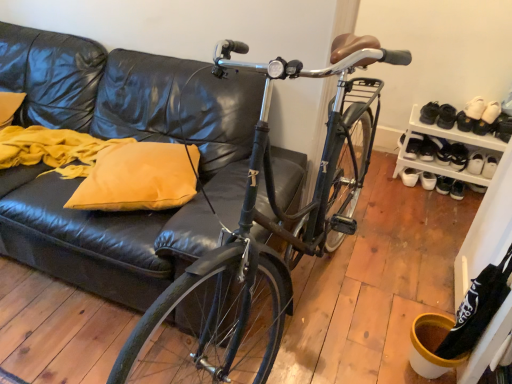
The image size is (512, 384). What do you see at coordinates (459, 156) in the screenshot? I see `black suede shoe at lower right, arranged as the fifth footwear when viewed from the right` at bounding box center [459, 156].

This screenshot has width=512, height=384. What do you see at coordinates (139, 178) in the screenshot?
I see `yellow fabric pillow at left` at bounding box center [139, 178].

Describe the element at coordinates (503, 128) in the screenshot. I see `white leather shoe at upper right, arranged as the 1th shoe when viewed from the front` at that location.

The image size is (512, 384). Identify the location of white leather shoe at upper right, the second shoe positioned from the left. (503, 128).

Find the location of a particular element. This screenshot has height=384, width=512. black suede shoe at lower right, arranged as the fifth footwear when viewed from the right is located at coordinates (459, 156).

What's the angular difference between white leather shoe at lower right, positioned as the 1th footwear in right-to-left order, and white suede shoe at upper right, the 7th footwear viewed from the left,'s facing directions?

2.08 degrees.

From a real-world perspective, is white leather shoe at lower right, positioned as the 1th footwear in right-to-left order, on white suede shoe at upper right, the 7th footwear viewed from the left?

Incorrect, from a real-world perspective, white leather shoe at lower right, positioned as the 1th footwear in right-to-left order, is lower than white suede shoe at upper right, the 7th footwear viewed from the left.

Considering the sizes of objects white leather shoe at lower right, positioned as the 1th footwear in right-to-left order, and white suede shoe at upper right, the 7th footwear viewed from the left, in the image provided, who is shorter, white leather shoe at lower right, positioned as the 1th footwear in right-to-left order, or white suede shoe at upper right, the 7th footwear viewed from the left,?

white suede shoe at upper right, the 7th footwear viewed from the left, is shorter.

Which is more to the left, white leather shoe at lower right, positioned as the 1th footwear in right-to-left order, or white suede shoe at upper right, which appears as the third footwear when viewed from the right?

From the viewer's perspective, white suede shoe at upper right, which appears as the third footwear when viewed from the right, appears more on the left side.

The image size is (512, 384). Identify the location of the 1st footwear behind the shiny black bicycle at center, starting your count from the anchor. (470, 114).

Which is farther from the camera, [367,53] or [466,122]?

The point [466,122] is behind.

Considering the sizes of objects shiny black bicycle at center and white suede shoes at upper right, acting as the 4th footwear starting from the right, in the image provided, who is bigger, shiny black bicycle at center or white suede shoes at upper right, acting as the 4th footwear starting from the right,?

Bigger between the two is shiny black bicycle at center.

Is shiny black bicycle at center facing away from white suede shoes at upper right, acting as the 4th footwear starting from the right?

That's right, shiny black bicycle at center is facing away from white suede shoes at upper right, acting as the 4th footwear starting from the right.

Is shiny black bicycle at center bigger or smaller than white leather shoe at right, which appears as the first footwear when viewed from the left?

Clearly, shiny black bicycle at center is larger in size than white leather shoe at right, which appears as the first footwear when viewed from the left.

From the image's perspective, between shiny black bicycle at center and white leather shoe at right, the 9th footwear when ordered from right to left, which one is located above?

white leather shoe at right, the 9th footwear when ordered from right to left, is shown above in the image.

Which object is further away from the camera, shiny black bicycle at center or white leather shoe at right, the 9th footwear when ordered from right to left?

white leather shoe at right, the 9th footwear when ordered from right to left.

Is point (285, 307) in front of point (420, 145)?

Yes, point (285, 307) is in front of point (420, 145).

How different are the orientations of white leather shoe at lower right, which is the 9th footwear from left to right, and black leather shoe at upper right, the third footwear in the left-to-right sequence, in degrees?

They differ by 6.02 degrees in their facing directions.

Which object is more forward, white leather shoe at lower right, positioned as the 1th footwear in right-to-left order, or black leather shoe at upper right, the third footwear in the left-to-right sequence?

black leather shoe at upper right, the third footwear in the left-to-right sequence, is more forward.

Looking at this image, would you say white leather shoe at lower right, positioned as the 1th footwear in right-to-left order, is inside or outside black leather shoe at upper right, which is counted as the seventh footwear, starting from the right?

white leather shoe at lower right, positioned as the 1th footwear in right-to-left order, is spatially situated outside black leather shoe at upper right, which is counted as the seventh footwear, starting from the right.

Is white leather shoe at lower right, positioned as the 1th footwear in right-to-left order, taller or shorter than black leather shoe at upper right, the third footwear in the left-to-right sequence?

Considering their sizes, white leather shoe at lower right, positioned as the 1th footwear in right-to-left order, has less height than black leather shoe at upper right, the third footwear in the left-to-right sequence.

The image size is (512, 384). Identify the location of bicycle located above the white matte sneakers at lower right, which ranks as the eighth footwear in right-to-left order (from a real-world perspective). (259, 244).

Looking at the image, does white matte sneakers at lower right, which ranks as the 2th footwear in left-to-right order, seem bigger or smaller compared to shiny black bicycle at center?

In the image, white matte sneakers at lower right, which ranks as the 2th footwear in left-to-right order, appears to be smaller than shiny black bicycle at center.

Is white matte sneakers at lower right, which ranks as the 2th footwear in left-to-right order, spatially inside shiny black bicycle at center, or outside of it?

white matte sneakers at lower right, which ranks as the 2th footwear in left-to-right order, lies outside shiny black bicycle at center.

Does point (408, 183) come farther from viewer compared to point (155, 318)?

Yes, point (408, 183) is farther from viewer.

Is white leather shoe at upper right, the 2th shoe viewed from the back, wider or thinner than white suede shoe at upper right, which appears as the third footwear when viewed from the right?

In the image, white leather shoe at upper right, the 2th shoe viewed from the back, appears to be more narrow than white suede shoe at upper right, which appears as the third footwear when viewed from the right.

Is white leather shoe at upper right, the second shoe positioned from the left, inside the boundaries of white suede shoe at upper right, which appears as the third footwear when viewed from the right, or outside?

white leather shoe at upper right, the second shoe positioned from the left, is not inside white suede shoe at upper right, which appears as the third footwear when viewed from the right, it's outside.

Between point (499, 127) and point (482, 115), which one is positioned behind?

The point (499, 127) is behind.

From the picture: Is white leather shoe at upper right, arranged as the 1th shoe when viewed from the front, oriented towards white suede shoe at upper right, the 7th footwear viewed from the left?

No.

From the picture: Measure the distance from white matte sneakers at lower right, which ranks as the 2th footwear in left-to-right order, to white plastic shoe rack at right.

white matte sneakers at lower right, which ranks as the 2th footwear in left-to-right order, and white plastic shoe rack at right are 9.38 inches apart from each other.

Between white matte sneakers at lower right, which ranks as the eighth footwear in right-to-left order, and white plastic shoe rack at right, which one has less height?

With less height is white matte sneakers at lower right, which ranks as the eighth footwear in right-to-left order.

Based on the photo, from the image's perspective, which object appears higher, white matte sneakers at lower right, which ranks as the eighth footwear in right-to-left order, or white plastic shoe rack at right?

white plastic shoe rack at right is shown above in the image.

The image size is (512, 384). Identify the location of shelf above the white matte sneakers at lower right, which ranks as the 2th footwear in left-to-right order (from a real-world perspective). (447, 139).

The height and width of the screenshot is (384, 512). In order to click on the 3rd footwear positioned above the white leather shoe at lower right, positioned as the 1th footwear in right-to-left order (from a real-world perspective) in this screenshot , I will do `click(487, 118)`.

At what (x,y) coordinates should I click in order to perform the action: click on the 1st footwear located beneath the shiny black bicycle at center (from a real-world perspective). Please return your answer as a coordinate pair (x, y). This screenshot has height=384, width=512. Looking at the image, I should click on (470, 114).

Based on their spatial positions, is white suede shoe at upper right, which appears as the third footwear when viewed from the right, or white leather shoe at right, arranged as the 1th shoe when viewed from the back, further from white leather shoe at lower right, which is the 9th footwear from left to right?

white suede shoe at upper right, which appears as the third footwear when viewed from the right, is further to white leather shoe at lower right, which is the 9th footwear from left to right.

Looking at the image, which one is located further to shiny black bicycle at center, yellow fabric pillow at left or black suede shoe at lower right, arranged as the fifth footwear when viewed from the right?

The object further to shiny black bicycle at center is black suede shoe at lower right, arranged as the fifth footwear when viewed from the right.

Based on their spatial positions, is white matte sneakers at lower right, which ranks as the 2th footwear in left-to-right order, or black leather shoe at upper right, which is counted as the seventh footwear, starting from the right, closer to white leather shoe at right, marked as the first shoe in a left-to-right arrangement?

black leather shoe at upper right, which is counted as the seventh footwear, starting from the right, is positioned closer to the anchor white leather shoe at right, marked as the first shoe in a left-to-right arrangement.

Estimate the real-world distances between objects in this image. Which object is further from shiny black bicycle at center, black suede shoe at lower right, arranged as the fifth footwear when viewed from the right, or white leather shoe at right, which ranks as the 2th shoe in front-to-back order?

black suede shoe at lower right, arranged as the fifth footwear when viewed from the right, is positioned further to the anchor shiny black bicycle at center.

Looking at the image, which one is located closer to white suede shoes at upper right, which ranks as the sixth footwear in left-to-right order, white leather shoe at upper right, marked as the first shoe in a right-to-left arrangement, or shiny black bicycle at center?

white leather shoe at upper right, marked as the first shoe in a right-to-left arrangement, is positioned closer to the anchor white suede shoes at upper right, which ranks as the sixth footwear in left-to-right order.

Which object lies nearer to the anchor point white suede shoes at upper right, acting as the 4th footwear starting from the right, white leather shoe at lower right, which is the 9th footwear from left to right, or white leather shoe at right, arranged as the 1th shoe when viewed from the back?

The object closer to white suede shoes at upper right, acting as the 4th footwear starting from the right, is white leather shoe at right, arranged as the 1th shoe when viewed from the back.

From the image, which object appears to be farther from white leather shoe at lower right, which is the 9th footwear from left to right, shiny black bicycle at center or white suede shoe at upper right, the 7th footwear viewed from the left?

shiny black bicycle at center lies further to white leather shoe at lower right, which is the 9th footwear from left to right, than the other object.

Considering their positions, is white leather shoe at right, the 9th footwear when ordered from right to left, positioned closer to black leather shoes at upper right, positioned as the 6th footwear in right-to-left order, than white plastic shoe rack at right?

Among the two, white plastic shoe rack at right is located nearer to black leather shoes at upper right, positioned as the 6th footwear in right-to-left order.

You are a GUI agent. You are given a task and a screenshot of the screen. Output one action in this format:
    pyautogui.click(x=<x>, y=<y>)
    Task: Click on the shoe situated between white leather shoe at right, marked as the first shoe in a left-to-right arrangement, and white leather shoe at lower right, positioned as the 1th footwear in right-to-left order, from left to right
    The width and height of the screenshot is (512, 384).
    Given the screenshot: What is the action you would take?
    pyautogui.click(x=503, y=128)

This screenshot has height=384, width=512. Identify the location of shelf that lies between white suede shoe at upper right, the 7th footwear viewed from the left, and white leather shoe at right, which is the second footwear in right-to-left order, from top to bottom. (447, 139).

Find the location of a particular element. Image resolution: width=512 pixels, height=384 pixels. shoe between white matte sneakers at lower right, which ranks as the eighth footwear in right-to-left order, and white leather shoe at right, which is the second footwear in right-to-left order, in the horizontal direction is located at coordinates (442, 150).

I want to click on shelf that lies between white suede shoe at upper right, the 7th footwear viewed from the left, and black suede shoe at lower right, arranged as the fifth footwear when viewed from the right, from top to bottom, so click(447, 139).